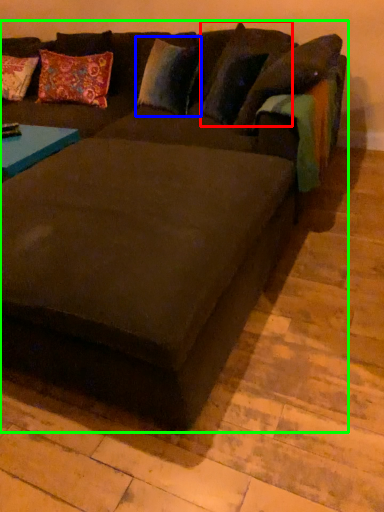
Question: Based on their relative distances, which object is nearer to pillow (highlighted by a red box)? Choose from pillow (highlighted by a blue box) and studio couch (highlighted by a green box).

Choices:
 (A) pillow
 (B) studio couch

Answer: (A)